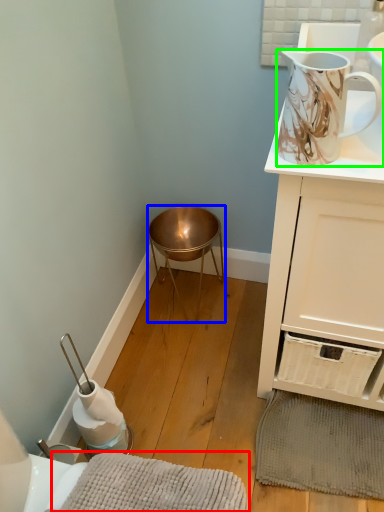
Question: Estimate the real-world distances between objects in this image. Which object is farther from bath mat (highlighted by a red box), stool (highlighted by a blue box) or jug (highlighted by a green box)?

Choices:
 (A) stool
 (B) jug

Answer: (A)